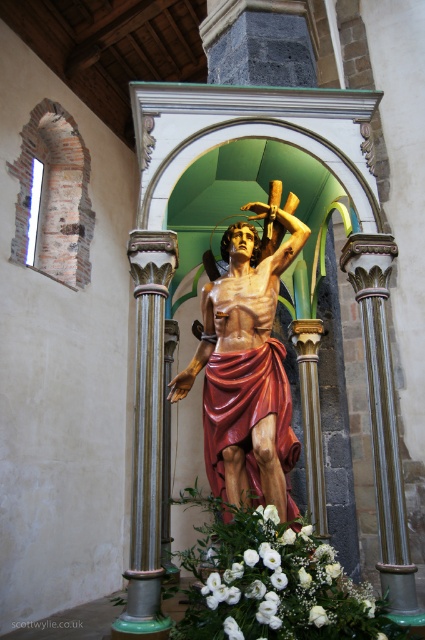
Question: Among these points, which one is farthest from the camera?

Choices:
 (A) (138, 436)
 (B) (218, 458)
 (C) (371, 435)

Answer: (B)

Question: Which point is closer to the camera?

Choices:
 (A) (249, 301)
 (B) (155, 454)
 (C) (306, 552)
 (D) (371, 369)

Answer: (C)

Question: Is white floral bouquet at lower center wider than gold textured column at center?

Choices:
 (A) no
 (B) yes

Answer: (B)

Question: Among these objects, which one is nearest to the camera?

Choices:
 (A) wooden statue at center
 (B) white matte flower at center
 (C) green marble column at center
 (D) gold textured column at center

Answer: (B)

Question: Does wooden statue at center appear over gold textured column at center?

Choices:
 (A) no
 (B) yes

Answer: (B)

Question: In this image, where is white floral bouquet at lower center located relative to gold textured column at center?

Choices:
 (A) below
 (B) above

Answer: (A)